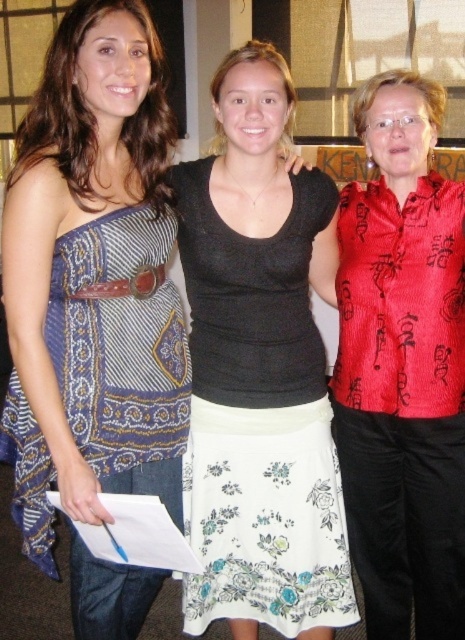
You are a photographer at a charity event and need to arrange the white floral skirt at center and the blue printed fabric dress at left in a group photo. Which of the two should be placed in the front to ensure both are visible?

The blue printed fabric dress at left should be placed in the front because the white floral skirt at center is taller, so placing the shorter one in front ensures both are visible without blocking each other.

You are a photographer at a charity event and need to arrange the red corduroy vest at center and the blue printed fabric dress at left for a group photo. Based on their current positions, which clothing item is more to the right?

The red corduroy vest at center is more to the right than the blue printed fabric dress at left because it is positioned on the right side of it.

You are at a party and want to approach the person wearing the white floral skirt at center. Which direction should you move relative to the blue printed fabric dress at left?

To reach the white floral skirt at center, you should move to the right of the blue printed fabric dress at left since the white floral skirt at center is positioned to the right of it.